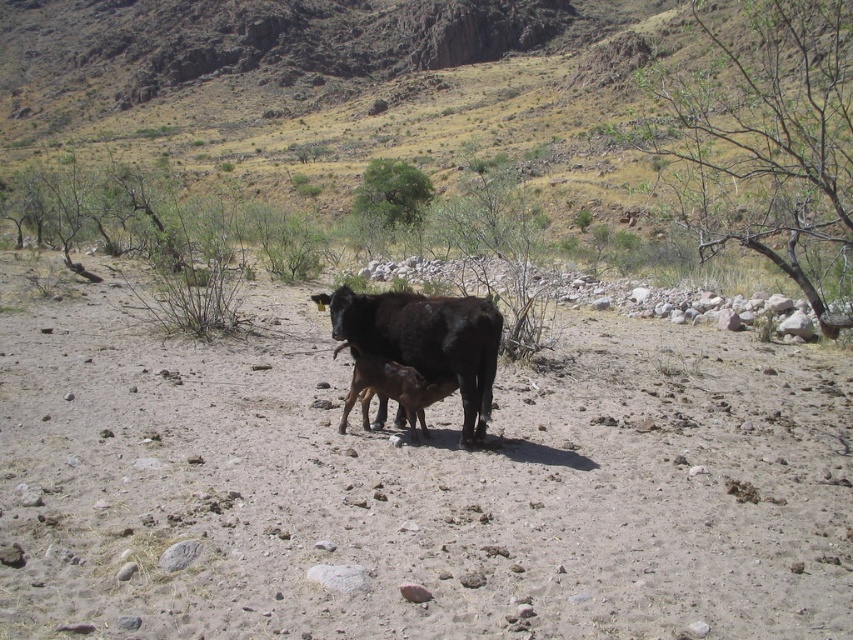
Which is more to the left, dull brown grassland at center or black glossy cow at center?

From the viewer's perspective, dull brown grassland at center appears more on the left side.

Is dull brown grassland at center bigger than black glossy cow at center?

Correct, dull brown grassland at center is larger in size than black glossy cow at center.

Between point (515, 33) and point (477, 403), which one is positioned in front?

Point (477, 403) is in front.

At what (x,y) coordinates should I click in order to perform the action: click on dull brown grassland at center. Please return your answer as a coordinate pair (x, y). This screenshot has width=853, height=640. Looking at the image, I should click on (289, 54).

Which of these two, dirt field at center or black glossy cow at center, stands shorter?

With less height is black glossy cow at center.

In the scene shown: Is dirt field at center wider than black glossy cow at center?

Indeed, dirt field at center has a greater width compared to black glossy cow at center.

Where is `dirt field at center`? The image size is (853, 640). dirt field at center is located at coordinates (416, 486).

Does dirt field at center appear on the right side of dull brown grassland at center?

Yes, dirt field at center is to the right of dull brown grassland at center.

Does point (346, 369) come closer to viewer compared to point (430, 10)?

That is True.

This screenshot has height=640, width=853. What are the coordinates of `dirt field at center` in the screenshot? It's located at (416, 486).